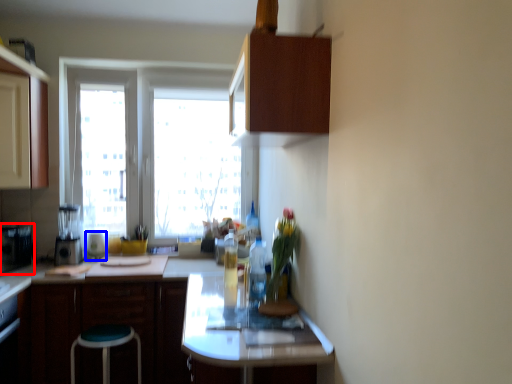
Question: Which object is closer to the camera taking this photo, appliance (highlighted by a red box) or appliance (highlighted by a blue box)?

Choices:
 (A) appliance
 (B) appliance

Answer: (A)